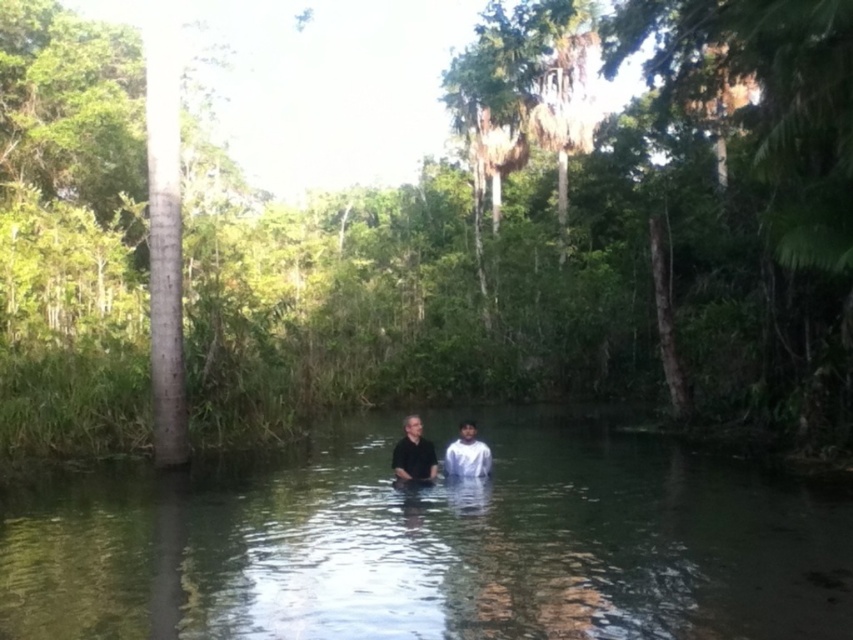
In the scene shown: You are a hiker who wants to take a photo of the black matte shirt at center and the green leafy jungle at center. You have a camera with a 50mm lens. Considering the distance between them, will you be able to capture both subjects in a single frame without moving the camera?

The green leafy jungle at center is 22.08 meters away from the black matte shirt at center. With a 50mm lens, the field of view is approximately 46 degrees. To capture both subjects in one frame, the distance between them should be within the lens field of view. However, since the distance is 22.08 meters, it might be challenging to fit both in the frame without moving the camera, depending on your position and zoom level.

You are a photographer aiming to capture the reflection of the surroundings in the clear water at center. Since the white matte shirt at center might obstruct the reflection, can you determine which object is larger to assess the potential obstruction?

The clear water at center is bigger than the white matte shirt at center, so the shirt is smaller and may not significantly obstruct the reflection.